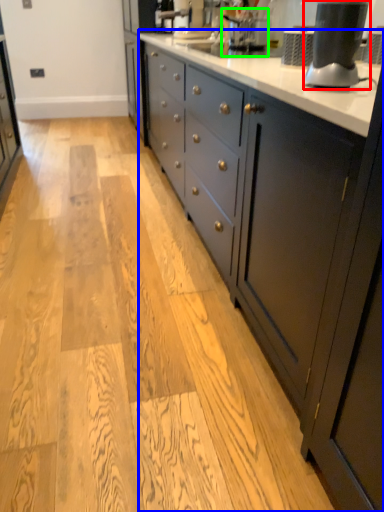
Question: Which object is positioned closest to home appliance (highlighted by a red box)? Select from countertop (highlighted by a blue box) and coffee machine (highlighted by a green box).

Choices:
 (A) countertop
 (B) coffee machine

Answer: (A)